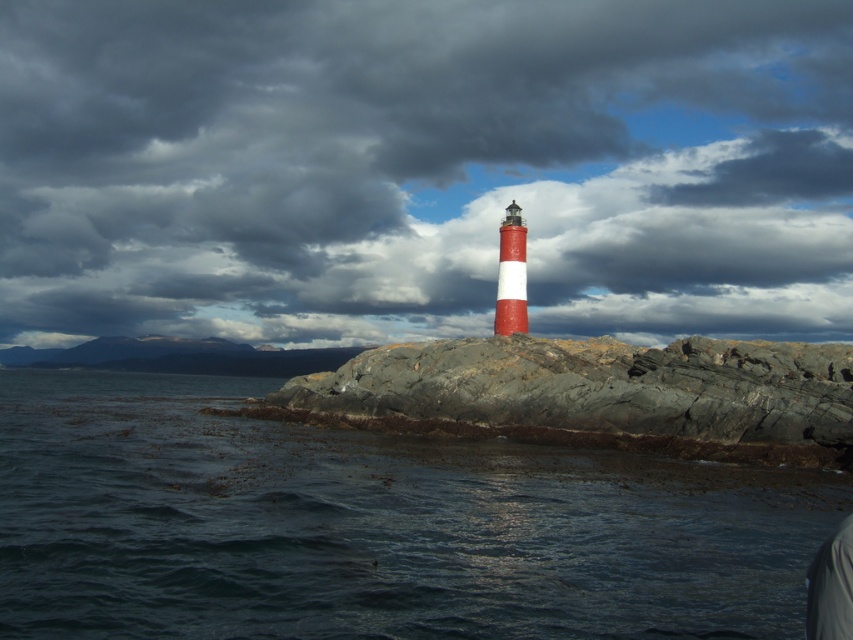
Which is more to the right, dark gray cloud at center or dark blue water at lower center?

Positioned to the right is dark gray cloud at center.

Between dark gray cloud at center and dark blue water at lower center, which one is positioned lower?

Positioned lower is dark blue water at lower center.

Between point (734, 124) and point (416, 518), which one is positioned behind?

Positioned behind is point (734, 124).

At what (x,y) coordinates should I click in order to perform the action: click on dark gray cloud at center. Please return your answer as a coordinate pair (x, y). Image resolution: width=853 pixels, height=640 pixels. Looking at the image, I should click on (422, 170).

Between dark gray cloud at center and rough granite rock at center, which one appears on the left side from the viewer's perspective?

dark gray cloud at center

Does point (660, 150) come farther from viewer compared to point (399, 404)?

Yes.

Identify the location of dark gray cloud at center. The width and height of the screenshot is (853, 640). (422, 170).

Does dark blue water at lower center appear on the left side of rough granite rock at center?

Yes, dark blue water at lower center is to the left of rough granite rock at center.

Does point (144, 458) lie in front of point (485, 339)?

Yes, it is.

Which is in front, point (564, 468) or point (704, 436)?

Point (564, 468) is in front.

This screenshot has height=640, width=853. Identify the location of dark blue water at lower center. (372, 525).